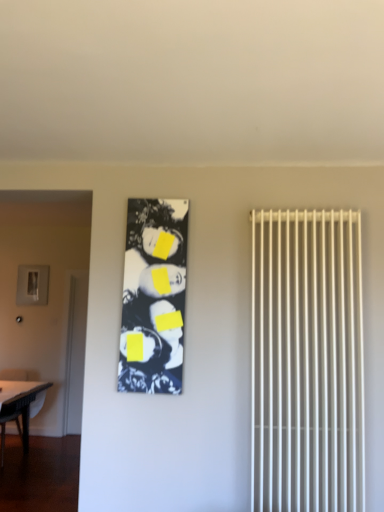
Question: In the image, is white plastic radiator at right positioned in front of or behind black glossy photo frame at center?

Choices:
 (A) behind
 (B) front

Answer: (B)

Question: Would you say white plastic radiator at right is to the left or to the right of black glossy photo frame at center in the picture?

Choices:
 (A) left
 (B) right

Answer: (B)

Question: Which object is the closest to the white glossy table at lower left?

Choices:
 (A) matte gray screen door at left
 (B) black glossy photo frame at center
 (C) white plastic radiator at right

Answer: (A)

Question: Considering the real-world distances, which object is farthest from the matte gray screen door at left?

Choices:
 (A) white plastic radiator at right
 (B) black glossy photo frame at center
 (C) white glossy table at lower left

Answer: (A)